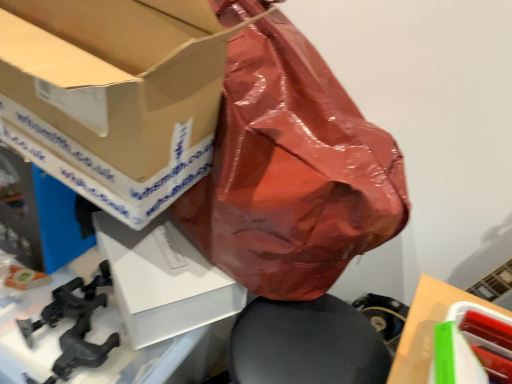
Question: Can you confirm if matte cardboard box at upper left, acting as the first box starting from the left, is thinner than green plastic container at lower right, arranged as the 3th box when viewed from the left?

Choices:
 (A) no
 (B) yes

Answer: (A)

Question: From the image's perspective, is matte cardboard box at upper left, acting as the first box starting from the left, over green plastic container at lower right, which appears as the 1th box when viewed from the right?

Choices:
 (A) yes
 (B) no

Answer: (A)

Question: Can you confirm if matte cardboard box at upper left, which is the third box from right to left, is shorter than green plastic container at lower right, arranged as the 3th box when viewed from the left?

Choices:
 (A) yes
 (B) no

Answer: (B)

Question: Is matte cardboard box at upper left, acting as the first box starting from the left, to the right of green plastic container at lower right, which appears as the 1th box when viewed from the right, from the viewer's perspective?

Choices:
 (A) yes
 (B) no

Answer: (B)

Question: Is matte cardboard box at upper left, acting as the first box starting from the left, wider than green plastic container at lower right, arranged as the 3th box when viewed from the left?

Choices:
 (A) no
 (B) yes

Answer: (B)

Question: Is matte cardboard box at upper left, which is the third box from right to left, closer to camera compared to green plastic container at lower right, which appears as the 1th box when viewed from the right?

Choices:
 (A) no
 (B) yes

Answer: (B)

Question: From a real-world perspective, is black matte clamp at lower left physically above matte cardboard box at upper left, which is the third box from right to left?

Choices:
 (A) no
 (B) yes

Answer: (A)

Question: Can you confirm if black matte clamp at lower left is shorter than matte cardboard box at upper left, acting as the first box starting from the left?

Choices:
 (A) yes
 (B) no

Answer: (A)

Question: Is black matte clamp at lower left smaller than matte cardboard box at upper left, acting as the first box starting from the left?

Choices:
 (A) no
 (B) yes

Answer: (B)

Question: Is black matte clamp at lower left aimed at matte cardboard box at upper left, acting as the first box starting from the left?

Choices:
 (A) yes
 (B) no

Answer: (B)

Question: Could matte cardboard box at upper left, which is the third box from right to left, be considered to be inside black matte clamp at lower left?

Choices:
 (A) yes
 (B) no

Answer: (B)

Question: Is the position of black matte clamp at lower left more distant than that of matte cardboard box at upper left, acting as the first box starting from the left?

Choices:
 (A) no
 (B) yes

Answer: (B)

Question: From a real-world perspective, is black matte clamp at lower left physically above white matte box at center, the second box from the right?

Choices:
 (A) yes
 (B) no

Answer: (B)